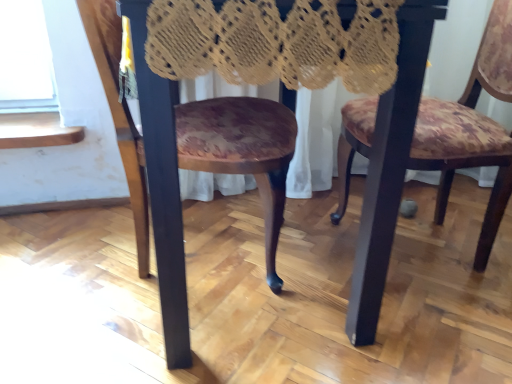
Question: Is floral fabric chair at center, marked as the second chair in a left-to-right arrangement, shorter than wooden table at center?

Choices:
 (A) yes
 (B) no

Answer: (A)

Question: Could wooden table at center be considered to be inside floral fabric chair at center, which is the first chair in right-to-left order?

Choices:
 (A) no
 (B) yes

Answer: (A)

Question: Is floral fabric chair at center, which is the first chair in right-to-left order, wider than wooden table at center?

Choices:
 (A) yes
 (B) no

Answer: (B)

Question: Are floral fabric chair at center, which is the first chair in right-to-left order, and wooden table at center making contact?

Choices:
 (A) yes
 (B) no

Answer: (B)

Question: From the image's perspective, is floral fabric chair at center, which is the first chair in right-to-left order, under wooden table at center?

Choices:
 (A) no
 (B) yes

Answer: (A)

Question: Is wooden floral-patterned chair at center, which is the second chair from right to left, taller or shorter than wooden table at center?

Choices:
 (A) short
 (B) tall

Answer: (A)

Question: Based on their sizes in the image, would you say wooden floral-patterned chair at center, which is the second chair from right to left, is bigger or smaller than wooden table at center?

Choices:
 (A) small
 (B) big

Answer: (A)

Question: Choose the correct answer: Is wooden floral-patterned chair at center, placed as the 1th chair when sorted from left to right, inside wooden table at center or outside it?

Choices:
 (A) inside
 (B) outside

Answer: (A)

Question: Looking at their shapes, would you say wooden floral-patterned chair at center, placed as the 1th chair when sorted from left to right, is wider or thinner than wooden table at center?

Choices:
 (A) wide
 (B) thin

Answer: (B)

Question: Based on their sizes in the image, would you say floral fabric chair at center, marked as the second chair in a left-to-right arrangement, is bigger or smaller than wooden table at center?

Choices:
 (A) big
 (B) small

Answer: (B)

Question: From their relative heights in the image, would you say floral fabric chair at center, which is the first chair in right-to-left order, is taller or shorter than wooden table at center?

Choices:
 (A) short
 (B) tall

Answer: (A)

Question: From the image's perspective, relative to wooden table at center, is floral fabric chair at center, marked as the second chair in a left-to-right arrangement, above or below?

Choices:
 (A) below
 (B) above

Answer: (B)

Question: Is floral fabric chair at center, which is the first chair in right-to-left order, in front of or behind wooden table at center in the image?

Choices:
 (A) behind
 (B) front

Answer: (A)

Question: From the image's perspective, is floral fabric chair at center, which is the first chair in right-to-left order, located above or below wooden floral-patterned chair at center, placed as the 1th chair when sorted from left to right?

Choices:
 (A) above
 (B) below

Answer: (A)

Question: In terms of size, does floral fabric chair at center, which is the first chair in right-to-left order, appear bigger or smaller than wooden floral-patterned chair at center, placed as the 1th chair when sorted from left to right?

Choices:
 (A) big
 (B) small

Answer: (A)